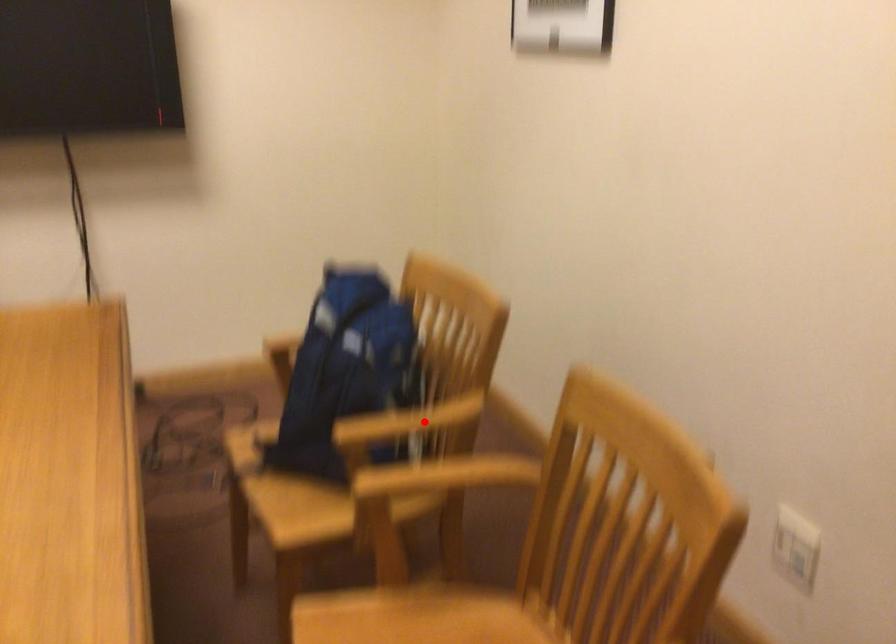
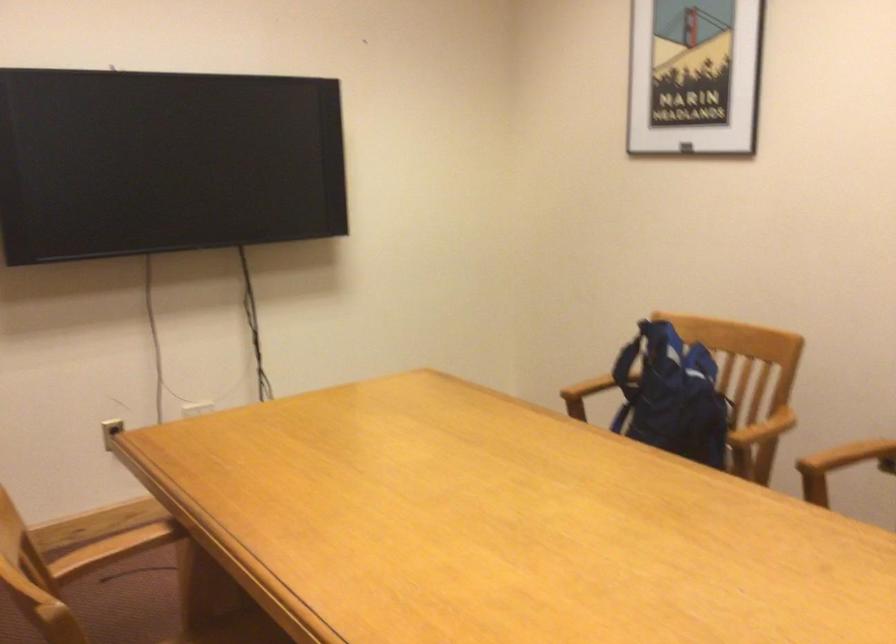
Where in the second image is the point corresponding to the highlighted location from the first image?

(763, 428)